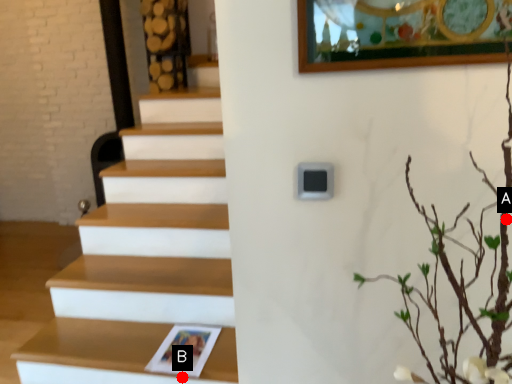
Question: Two points are circled on the image, labeled by A and B beside each circle. Which of the following is the closest to the observer?

Choices:
 (A) A is closer
 (B) B is closer

Answer: (A)